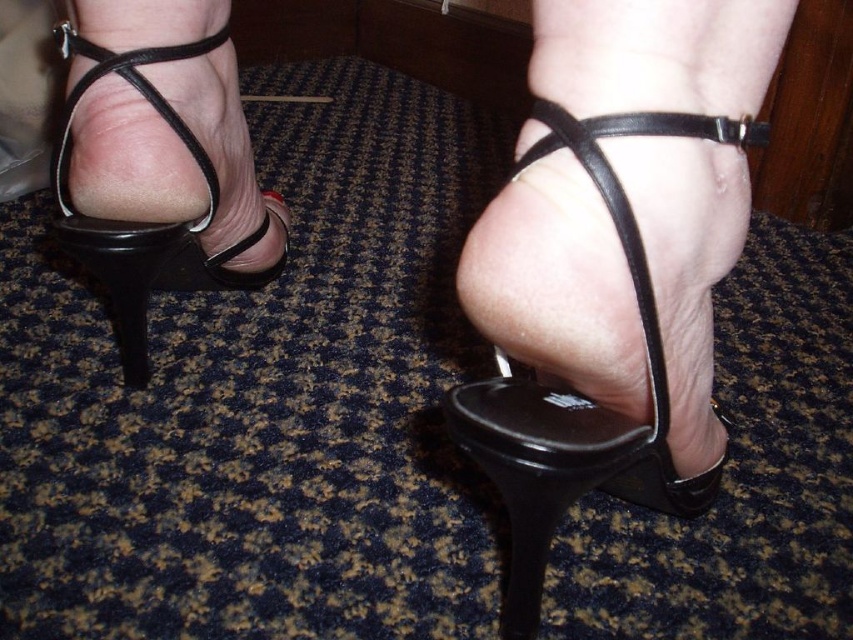
Is matte black sandal at center bigger than black leather sandal at left?

Actually, matte black sandal at center might be smaller than black leather sandal at left.

Is matte black sandal at center shorter than black leather sandal at left?

Indeed, matte black sandal at center has a lesser height compared to black leather sandal at left.

At what (x,y) coordinates should I click in order to perform the action: click on matte black sandal at center. Please return your answer as a coordinate pair (x, y). The width and height of the screenshot is (853, 640). Looking at the image, I should click on (576, 392).

What are the coordinates of `matte black sandal at center` in the screenshot? It's located at (576, 392).